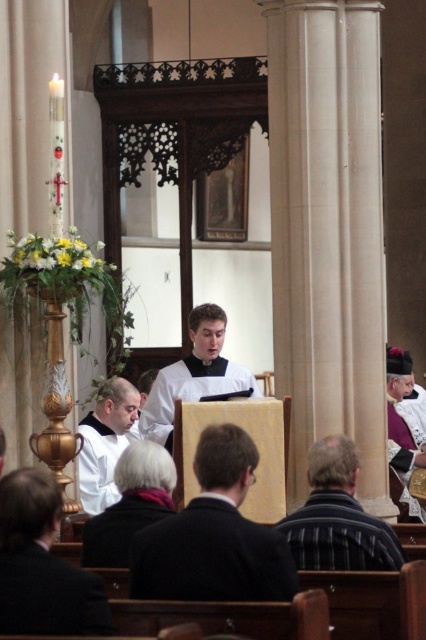
You are an interior designer assessing the space for a new speaker podium. You need to ensure that the podium will not block the view of the dark woolen robe at lower center and the purple velvet robe at center from the pews. Which robe will require the podium to be placed closer to the front to maintain visibility?

The dark woolen robe at lower center is shorter than the purple velvet robe at center. To ensure visibility for both robes, the podium should be placed closer to the front so that the shorter dark woolen robe at lower center remains visible over the podium.

You are an event planner organizing a photoshoot in this church. You need to position a camera on a tripod to capture both the dark suit at center and the purple velvet robe at center. Which object should the camera focus on first to ensure both are in the frame?

The camera should focus on the purple velvet robe at center first because the dark suit at center is above it, so adjusting the frame to include the lower robe will naturally include the suit above.

You are standing at point A at the point labeled point (385, 554). You want to walk to point B, which is 133.68 feet away. Is there enough space to walk directly to point B without any obstacles?

The distance between point A at point (385, 554) and point B is 133.68 feet. Since the scene is set in a church with pews and columns, there might be obstacles in the way. However, the description does not mention any obstacles between the two points, so it is possible to walk directly to point B if there are no physical barriers.